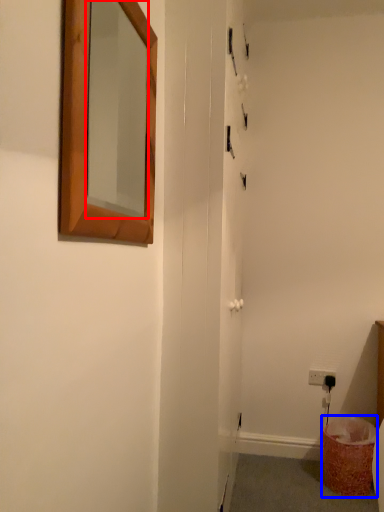
Question: Which object is further to the camera taking this photo, mirror (highlighted by a red box) or laundry basket (highlighted by a blue box)?

Choices:
 (A) mirror
 (B) laundry basket

Answer: (B)